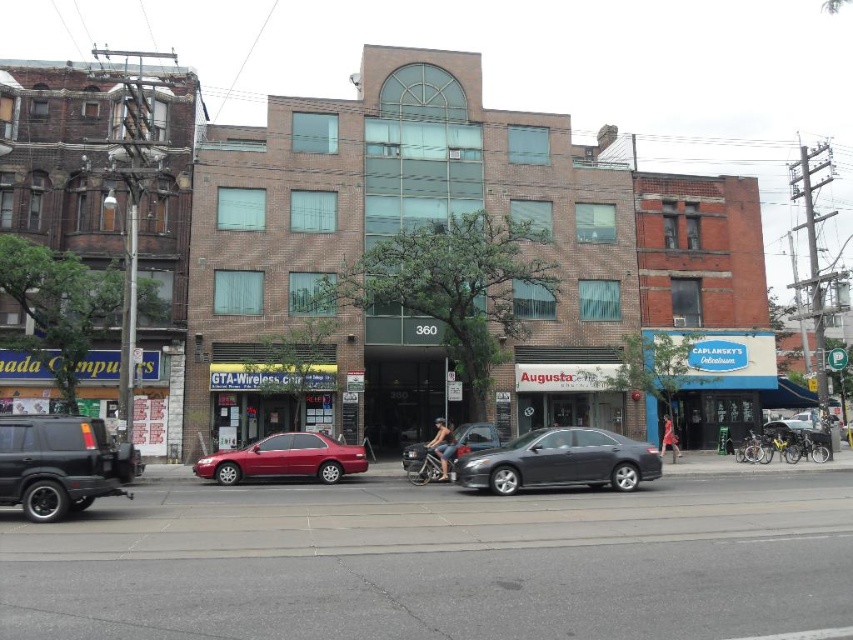
You are a delivery person needing to park your vehicle between the two cars shown in the scene. The black matte suv at lower left and the glossy red sedan at center. Which car should you park behind to ensure you are closest to the entrance with the number 360?

You should park behind the glossy red sedan at center because the black matte suv at lower left is in front of it, meaning the glossy red sedan at center is closer to the entrance with the number 360.

You are a delivery driver who needs to park your 6.5 meter long truck between the black matte suv at lower left and the metallic silver car at center. Is there enough space between them for your truck?

The black matte suv at lower left is 9.17 meters away from the metallic silver car at center. Since the distance between them is greater than the truck length of 6.5 meters, the truck can be parked between the black matte suv at lower left and the metallic silver car at center.

You are a pedestrian standing on the sidewalk in front of the building with the number 360. You see a glossy red sedan at center and a metallic silver car at center. Which car is positioned higher relative to the other?

The glossy red sedan at center is above the metallic silver car at center, so it is positioned higher.